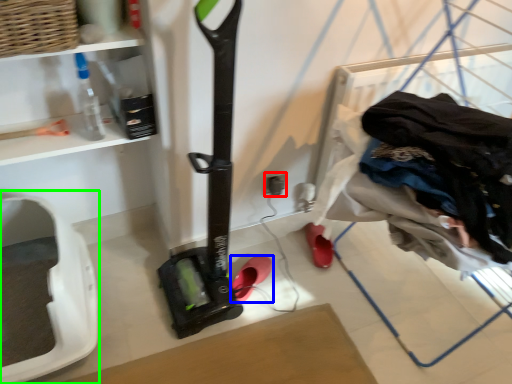
Question: Considering the real-world distances, which object is farthest from electric outlet (highlighted by a red box)? footwear (highlighted by a blue box) or appliance (highlighted by a green box)?

Choices:
 (A) footwear
 (B) appliance

Answer: (B)